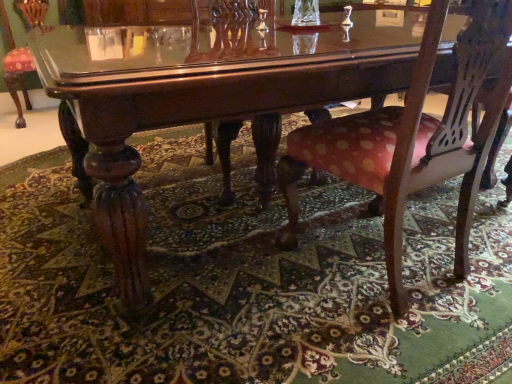
In order to click on carpeted floor at center in this screenshot , I will do `click(246, 284)`.

What is the approximate width of carpeted floor at center?

The width of carpeted floor at center is 2.53 meters.

The width and height of the screenshot is (512, 384). What do you see at coordinates (246, 284) in the screenshot? I see `carpeted floor at center` at bounding box center [246, 284].

This screenshot has height=384, width=512. In order to click on polka dot fabric chair at center in this screenshot , I will do `click(412, 139)`.

This screenshot has height=384, width=512. Describe the element at coordinates (412, 139) in the screenshot. I see `polka dot fabric chair at center` at that location.

You are a GUI agent. You are given a task and a screenshot of the screen. Output one action in this format:
    pyautogui.click(x=<x>, y=<y>)
    Task: Click on the carpeted floor at center
    The width and height of the screenshot is (512, 384).
    Given the screenshot: What is the action you would take?
    pyautogui.click(x=246, y=284)

Visually, is polka dot fabric chair at center positioned to the left or to the right of carpeted floor at center?

polka dot fabric chair at center is positioned on carpeted floor at center's right side.

Which object is closer to the camera, polka dot fabric chair at center or carpeted floor at center?

carpeted floor at center is more forward.

Which is closer to the camera, (410, 168) or (439, 253)?

Point (410, 168) appears to be closer to the viewer than point (439, 253).

From the image's perspective, is polka dot fabric chair at center on top of carpeted floor at center?

Indeed, from the image's perspective, polka dot fabric chair at center is shown above carpeted floor at center.

From a real-world perspective, is polka dot fabric chair at center positioned under carpeted floor at center based on gravity?

Actually, polka dot fabric chair at center is physically above carpeted floor at center in the real world.

Considering the sizes of objects polka dot fabric chair at center and carpeted floor at center in the image provided, who is wider, polka dot fabric chair at center or carpeted floor at center?

Wider between the two is carpeted floor at center.

Is polka dot fabric chair at center taller or shorter than carpeted floor at center?

Considering their sizes, polka dot fabric chair at center has more height than carpeted floor at center.

Which of these two, polka dot fabric chair at center or carpeted floor at center, is smaller?

Smaller between the two is polka dot fabric chair at center.

From the picture: Is carpeted floor at center inside polka dot fabric chair at center?

Definitely not — carpeted floor at center is not inside polka dot fabric chair at center.

Is polka dot fabric chair at center placed right next to carpeted floor at center?

No, polka dot fabric chair at center is not touching carpeted floor at center.

Is polka dot fabric chair at center aimed at carpeted floor at center?

Yes, polka dot fabric chair at center faces towards carpeted floor at center.

What's the angular difference between polka dot fabric chair at center and carpeted floor at center's facing directions?

They differ by 5.16 degrees in their facing directions.

Measure the distance from polka dot fabric chair at center to carpeted floor at center.

polka dot fabric chair at center and carpeted floor at center are 18.08 inches apart from each other.

Where is `mat in front of the polka dot fabric chair at center`? mat in front of the polka dot fabric chair at center is located at coordinates (246, 284).

Which is more to the right, carpeted floor at center or polka dot fabric chair at center?

polka dot fabric chair at center.

Between carpeted floor at center and polka dot fabric chair at center, which one is positioned behind?

polka dot fabric chair at center is more distant.

Based on the photo, which is less distant, (x=125, y=334) or (x=294, y=242)?

Point (x=125, y=334) appears to be closer to the viewer than point (x=294, y=242).

Looking at this image, from the image's perspective, who appears lower, carpeted floor at center or polka dot fabric chair at center?

From the image's view, carpeted floor at center is below.

From a real-world perspective, is carpeted floor at center positioned over polka dot fabric chair at center based on gravity?

No, from a real-world perspective, carpeted floor at center is not over polka dot fabric chair at center

Is carpeted floor at center thinner than polka dot fabric chair at center?

No, carpeted floor at center is not thinner than polka dot fabric chair at center.

Who is taller, carpeted floor at center or polka dot fabric chair at center?

polka dot fabric chair at center is taller.

Considering the sizes of objects carpeted floor at center and polka dot fabric chair at center in the image provided, who is bigger, carpeted floor at center or polka dot fabric chair at center?

carpeted floor at center is bigger.

Is carpeted floor at center inside the boundaries of polka dot fabric chair at center, or outside?

carpeted floor at center is located beyond the bounds of polka dot fabric chair at center.

Based on the photo, are carpeted floor at center and polka dot fabric chair at center beside each other?

No, carpeted floor at center is not making contact with polka dot fabric chair at center.

Could you tell me if carpeted floor at center is facing polka dot fabric chair at center?

No.

Locate an element on the screen. chair lying above the carpeted floor at center (from the image's perspective) is located at coordinates (412, 139).

In the image, there is a carpeted floor at center. Where is `chair above it (from the image's perspective)`? This screenshot has height=384, width=512. chair above it (from the image's perspective) is located at coordinates (412, 139).

Locate an element on the screen. This screenshot has height=384, width=512. mat located on the left of polka dot fabric chair at center is located at coordinates (246, 284).